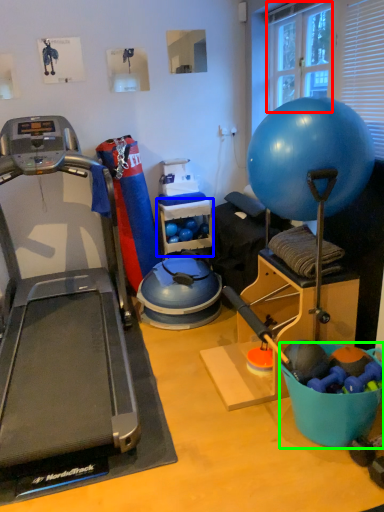
Question: Which is farther away from window screen (highlighted by a red box)? shelf (highlighted by a blue box) or bowl (highlighted by a green box)?

Choices:
 (A) shelf
 (B) bowl

Answer: (B)